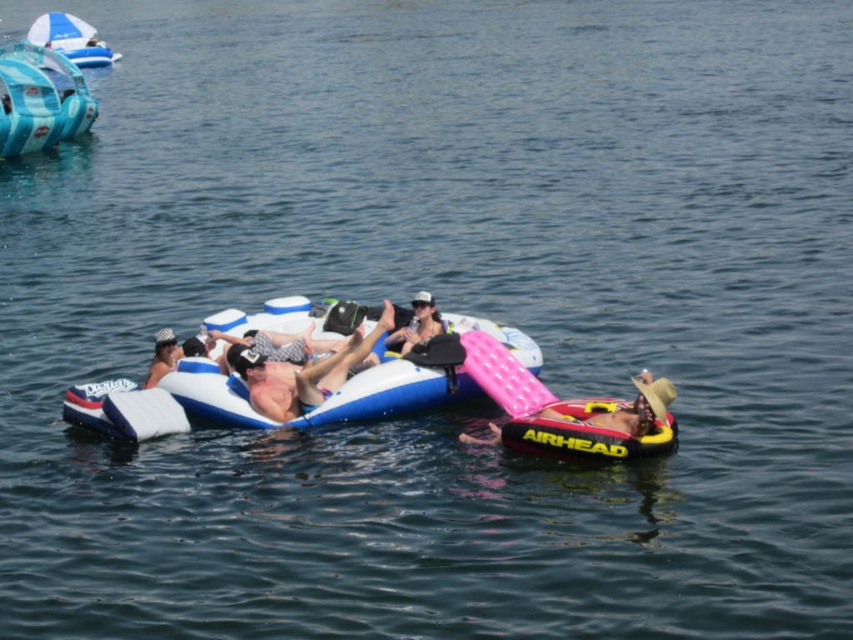
You are planning to take a group of 6 people for a water activity. You see the blue inflatable raft at center and the blue inflatable boat at upper left. Which one can accommodate more people based on their size?

The blue inflatable raft at center can accommodate more people because its width is greater than the blue inflatable boat at upper left.

You are standing at the camera position and want to take a photo of the blue inflatable raft at center. The camera has a maximum zoom range of 30 meters. Can you capture the raft without moving closer?

The blue inflatable raft at center is 39.03 meters away from the camera, which exceeds the camera maximum zoom range of 30 meters. Therefore, you cannot capture the raft without moving closer.

You are on a boat and want to move towards the blue inflatable raft at center. Which direction should you go from the blue inflatable boat at upper left?

You should go to the right from the blue inflatable boat at upper left to reach the blue inflatable raft at center.